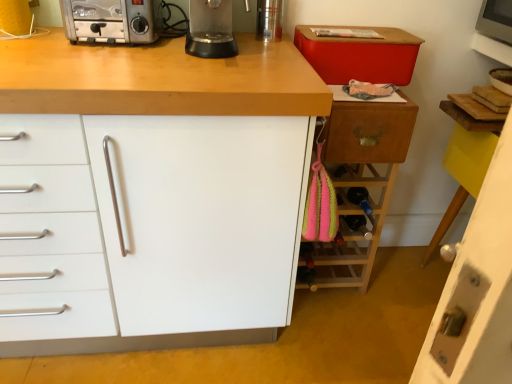
The image size is (512, 384). I want to click on free space above wooden drawer at right (from a real-world perspective), so click(x=371, y=92).